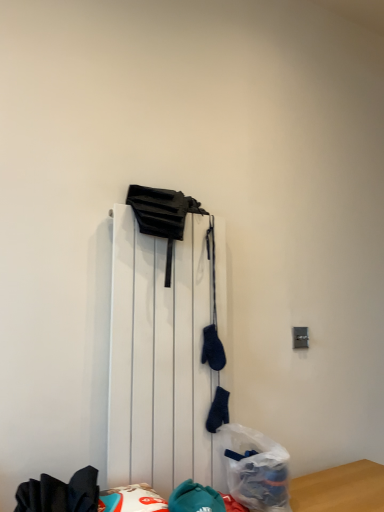
Question: Is translucent plastic bag at lower center in front of or behind white matte radiator at center in the image?

Choices:
 (A) front
 (B) behind

Answer: (B)

Question: Considering the positions of point (259, 462) and point (163, 453), is point (259, 462) closer or farther from the camera than point (163, 453)?

Choices:
 (A) closer
 (B) farther

Answer: (A)

Question: From a real-world perspective, is translucent plastic bag at lower center physically located above or below white matte radiator at center?

Choices:
 (A) above
 (B) below

Answer: (B)

Question: Relative to translucent plastic bag at lower center, is white matte radiator at center in front or behind?

Choices:
 (A) behind
 (B) front

Answer: (B)

Question: From a real-world perspective, relative to translucent plastic bag at lower center, is white matte radiator at center vertically above or below?

Choices:
 (A) below
 (B) above

Answer: (B)

Question: Is white matte radiator at center inside or outside of translucent plastic bag at lower center?

Choices:
 (A) inside
 (B) outside

Answer: (B)

Question: Is point (150, 248) closer or farther from the camera than point (274, 464)?

Choices:
 (A) farther
 (B) closer

Answer: (A)